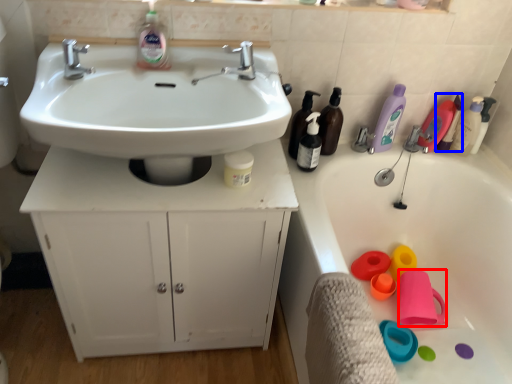
Question: Which object is closer to the camera taking this photo, toy (highlighted by a red box) or cleaning product (highlighted by a blue box)?

Choices:
 (A) toy
 (B) cleaning product

Answer: (A)